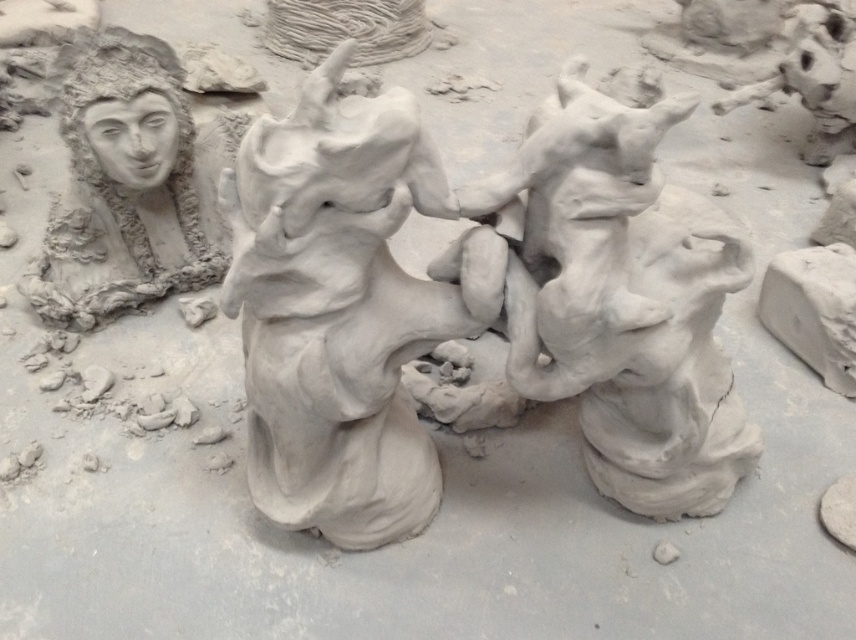
Question: Which point appears closest to the camera in this image?

Choices:
 (A) (431, 304)
 (B) (131, 253)
 (C) (538, 310)

Answer: (C)

Question: Which point is farther from the camera taking this photo?

Choices:
 (A) (595, 404)
 (B) (299, 385)

Answer: (A)

Question: Which point is farther to the camera?

Choices:
 (A) (56, 291)
 (B) (491, 186)

Answer: (A)

Question: Is clay sculpture at center above matte clay face at upper left?

Choices:
 (A) yes
 (B) no

Answer: (B)

Question: Observing the image, what is the correct spatial positioning of clay figure at center in reference to matte clay face at upper left?

Choices:
 (A) below
 (B) above

Answer: (A)

Question: Does clay figure at center appear on the left side of clay sculpture at center?

Choices:
 (A) yes
 (B) no

Answer: (A)